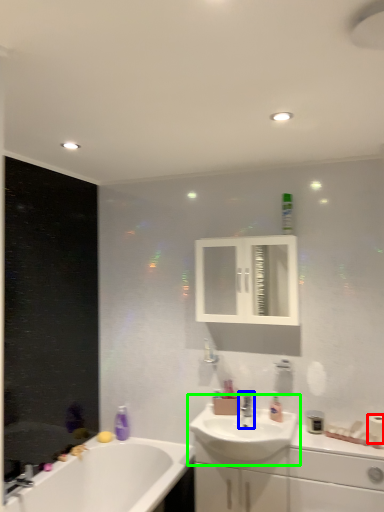
Question: Based on their relative distances, which object is farther from toilet paper (highlighted by a red box)? Choose from tap (highlighted by a blue box) and sink (highlighted by a green box).

Choices:
 (A) tap
 (B) sink

Answer: (A)